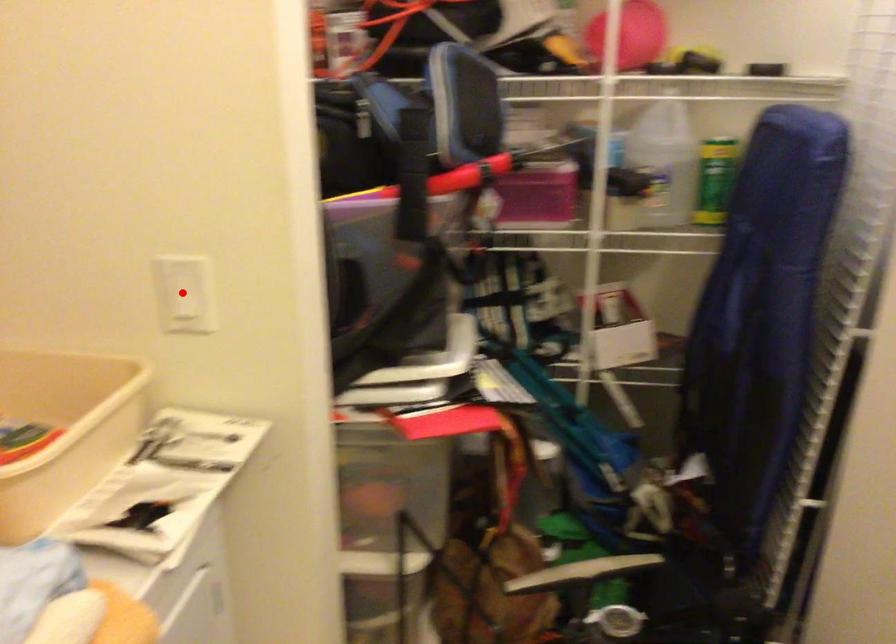
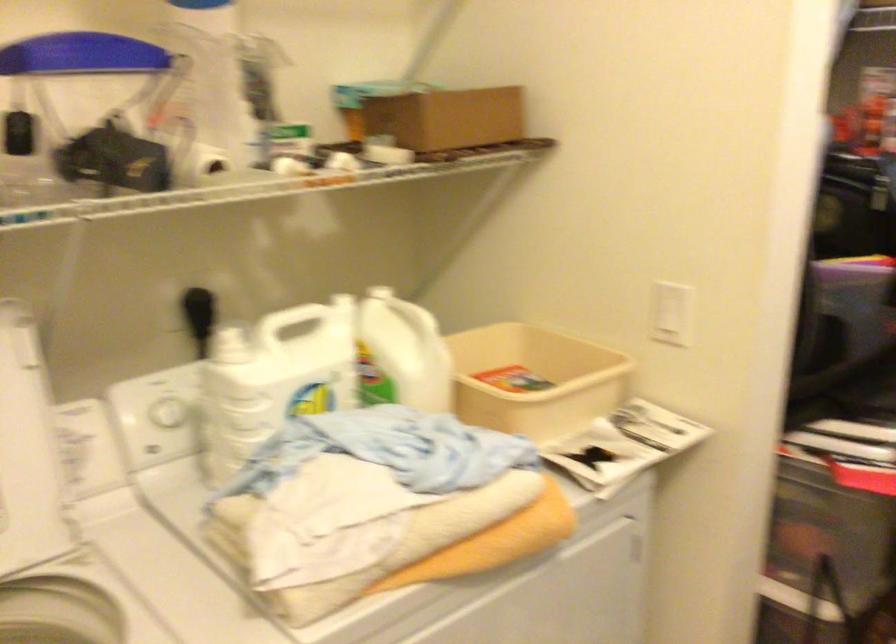
Question: A red point is marked in image1. In image2, is the corresponding 3D point closer to the camera or farther? Reply with the corresponding letter.

Choices:
 (A) The corresponding 3D point is closer.
 (B) The corresponding 3D point is farther.

Answer: (B)